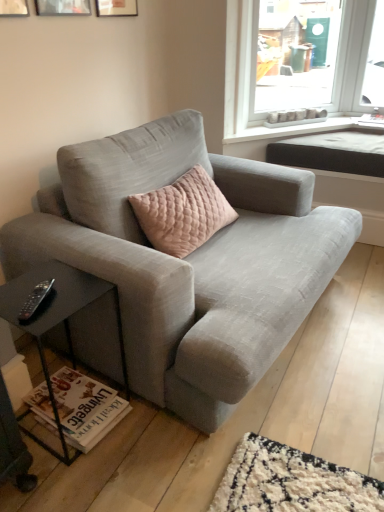
Question: Is textured gray couch at center facing away from black plastic remote at lower left?

Choices:
 (A) yes
 (B) no

Answer: (B)

Question: Is textured gray couch at center not close to black plastic remote at lower left?

Choices:
 (A) yes
 (B) no

Answer: (B)

Question: Are textured gray couch at center and black plastic remote at lower left beside each other?

Choices:
 (A) yes
 (B) no

Answer: (B)

Question: Does textured gray couch at center appear on the right side of black plastic remote at lower left?

Choices:
 (A) yes
 (B) no

Answer: (A)

Question: From the image's perspective, is textured gray couch at center located above black plastic remote at lower left?

Choices:
 (A) no
 (B) yes

Answer: (B)

Question: Is matte wooden picture frame at upper center, the 3th picture frame positioned from the left, inside the boundaries of black matte side table at lower left, or outside?

Choices:
 (A) inside
 (B) outside

Answer: (B)

Question: In the image, is matte wooden picture frame at upper center, the 3th picture frame positioned from the left, positioned in front of or behind black matte side table at lower left?

Choices:
 (A) behind
 (B) front

Answer: (A)

Question: From a real-world perspective, is matte wooden picture frame at upper center, the 3th picture frame positioned from the left, physically located above or below black matte side table at lower left?

Choices:
 (A) above
 (B) below

Answer: (A)

Question: Is matte wooden picture frame at upper center, the first picture frame viewed from the right, taller or shorter than black matte side table at lower left?

Choices:
 (A) tall
 (B) short

Answer: (B)

Question: Visually, is black matte side table at lower left positioned to the left or to the right of textured gray couch at center?

Choices:
 (A) right
 (B) left

Answer: (B)

Question: Is black matte side table at lower left wider or thinner than textured gray couch at center?

Choices:
 (A) thin
 (B) wide

Answer: (A)

Question: From the image's perspective, is black matte side table at lower left positioned above or below textured gray couch at center?

Choices:
 (A) above
 (B) below

Answer: (B)

Question: In terms of height, does black matte side table at lower left look taller or shorter compared to textured gray couch at center?

Choices:
 (A) short
 (B) tall

Answer: (A)

Question: Is black plastic remote at lower left taller or shorter than textured gray couch at center?

Choices:
 (A) tall
 (B) short

Answer: (B)

Question: Relative to textured gray couch at center, is black plastic remote at lower left in front or behind?

Choices:
 (A) behind
 (B) front

Answer: (A)